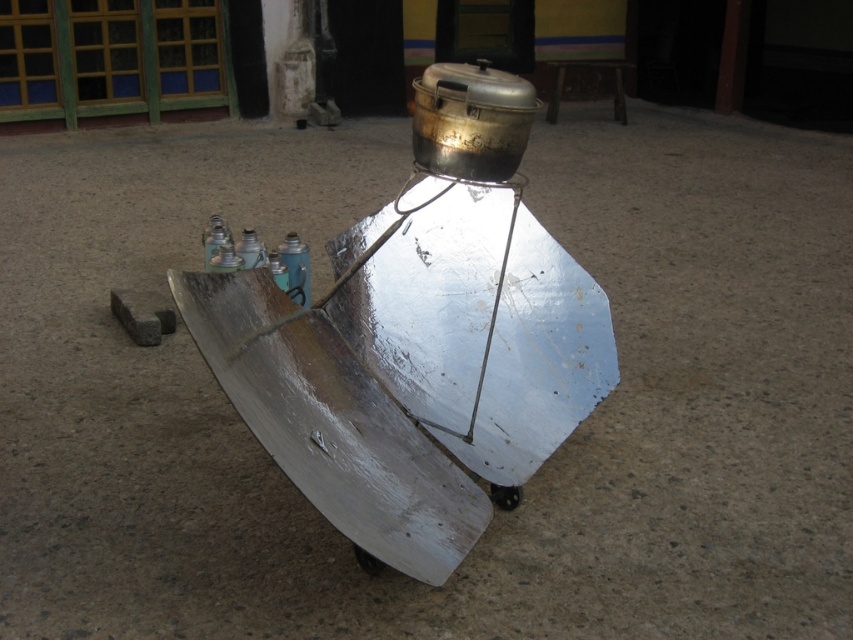
You are setting up the solar cooker and need to place both the brushed metal spray can at center and the blue matte bottle at center on the triangular reflective surface. Which one should you place first to ensure stability?

The brushed metal spray can at center has a lesser height compared to the blue matte bottle at center. Place the taller blue matte bottle at center first to provide a stable base, then the shorter spray can on top.

You are setting up the solar cooker and need to place the matte blue bottle at center and the brushed metal spray can at center on the triangular reflective surface. Which object should you place closer to the edge to prevent it from tipping over?

The matte blue bottle at center has a smaller size compared to the brushed metal spray can at center. Since smaller objects are generally lighter, placing the matte blue bottle at center closer to the edge would help balance the weight distribution and prevent the solar cooker from tipping over.

You are a delivery person who needs to place a package between the matte blue bottle at center and the brushed metal spray can at center. The package is 3 inches long. Can you fit it between them without moving either object?

The distance between the matte blue bottle at center and the brushed metal spray can at center is 2.51 inches. Since the package is 3 inches long, which is longer than the available space, it cannot fit between them without moving either object.